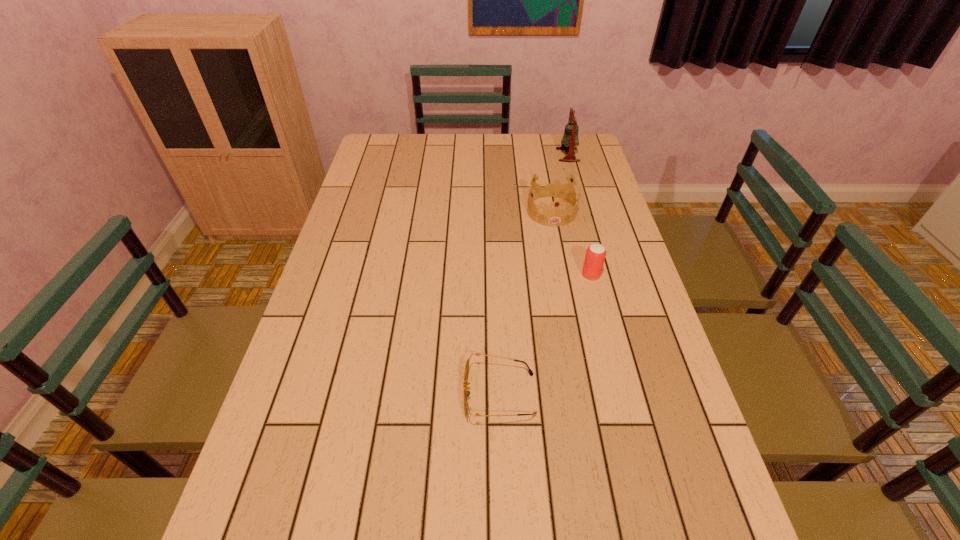
Locate an element on the screen. The image size is (960, 540). vacant space that satisfies the following two spatial constraints: 1. on the front-facing side of the tiara; 2. on the lenses of the shortest object is located at coordinates (587, 394).